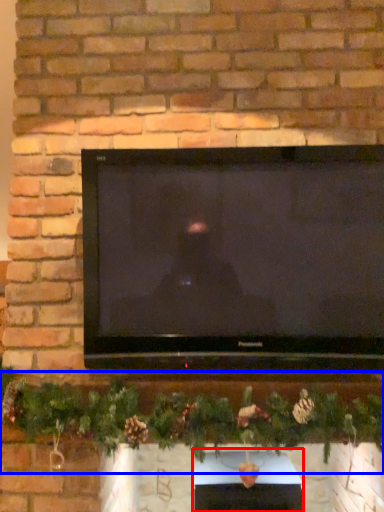
Question: Among these objects, which one is nearest to the camera, fireplace (highlighted by a red box) or christmas decoration (highlighted by a blue box)?

Choices:
 (A) fireplace
 (B) christmas decoration

Answer: (B)